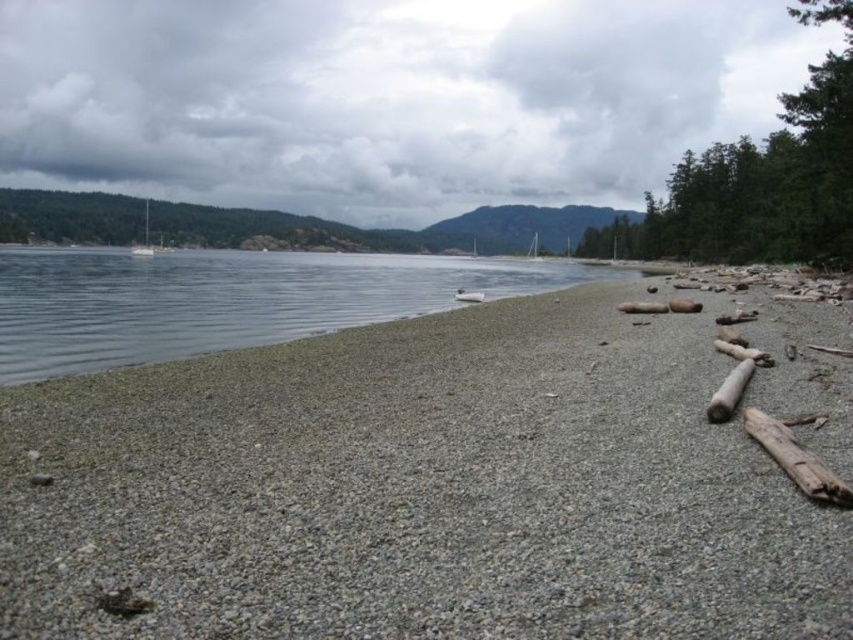
Which is more to the right, gray gravelly sand at lower left or clear water at center?

gray gravelly sand at lower left

Who is more forward, (x=312, y=362) or (x=381, y=280)?

Point (x=312, y=362) is in front.

What are the coordinates of `gray gravelly sand at lower left` in the screenshot? It's located at (416, 490).